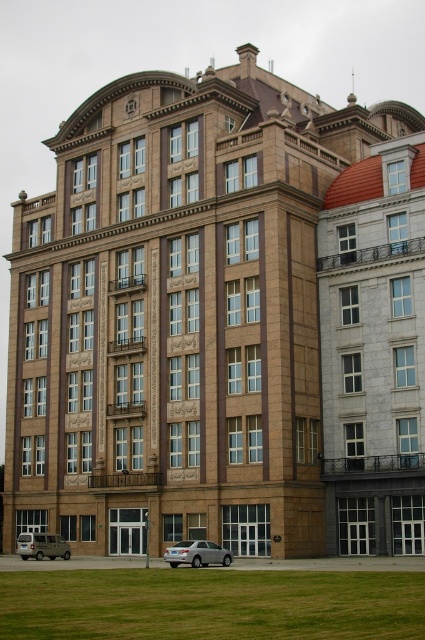
You are a delivery driver who needs to park your matte silver van at lower left in a parking spot that can only accommodate vehicles that take up as much space as the satin silver sedan at lower center. Can your van fit in the parking spot?

The satin silver sedan at lower center occupies less space than the matte silver van at lower left, so the van cannot fit in the parking spot designed for the sedan.

You are a delivery driver who needs to park your matte silver van at lower left in a parking spot that can only accommodate vehicles narrower than the satin silver sedan at lower center. Can your van fit in the spot?

The satin silver sedan at lower center is narrower than the matte silver van at lower left. Therefore, the parking spot designed for vehicles narrower than the sedan cannot accommodate the matte silver van at lower left, so it cannot fit.